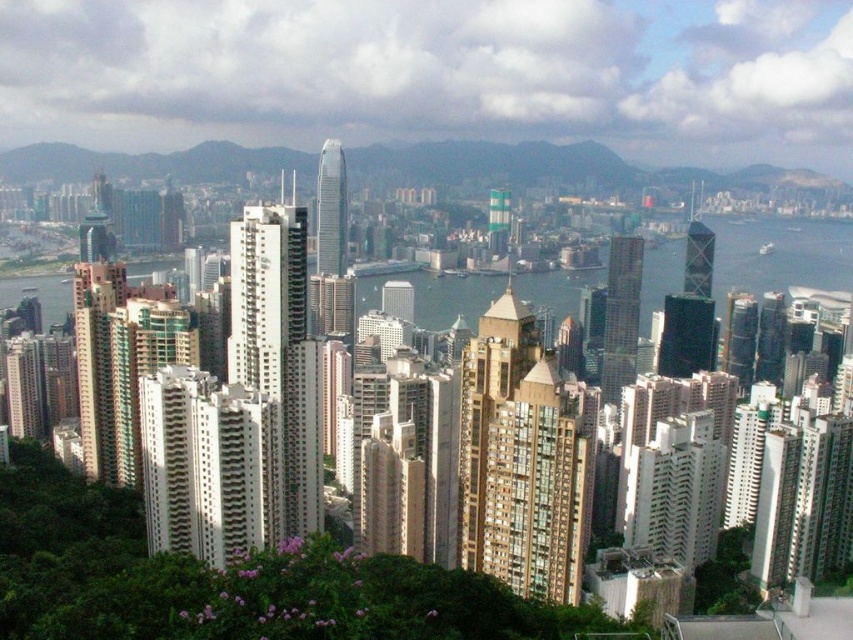
Can you confirm if green grassy hillside at upper center is positioned to the left of white textured building at center?

Incorrect, green grassy hillside at upper center is not on the left side of white textured building at center.

Is green grassy hillside at upper center shorter than white textured building at center?

Yes.

Which is behind, point (299, 150) or point (239, 358)?

Point (299, 150)

At what (x,y) coordinates should I click in order to perform the action: click on green grassy hillside at upper center. Please return your answer as a coordinate pair (x, y). Image resolution: width=853 pixels, height=640 pixels. Looking at the image, I should click on (546, 168).

Does gold glassy building at center appear under shiny glass skyscraper at center?

Correct, gold glassy building at center is located below shiny glass skyscraper at center.

Who is more forward, (537, 460) or (602, 356)?

Positioned in front is point (537, 460).

Does point (547, 444) come farther from viewer compared to point (619, 321)?

No, it is in front of (619, 321).

Locate an element on the screen. This screenshot has width=853, height=640. gold glassy building at center is located at coordinates (521, 458).

Can you confirm if gold glassy building at center is bigger than glassy reflective skyscraper at center-right?

Indeed, gold glassy building at center has a larger size compared to glassy reflective skyscraper at center-right.

Measure the distance between point (x=532, y=410) and camera.

Point (x=532, y=410) is 468.46 meters away from camera.

At what (x,y) coordinates should I click in order to perform the action: click on gold glassy building at center. Please return your answer as a coordinate pair (x, y). This screenshot has width=853, height=640. Looking at the image, I should click on (521, 458).